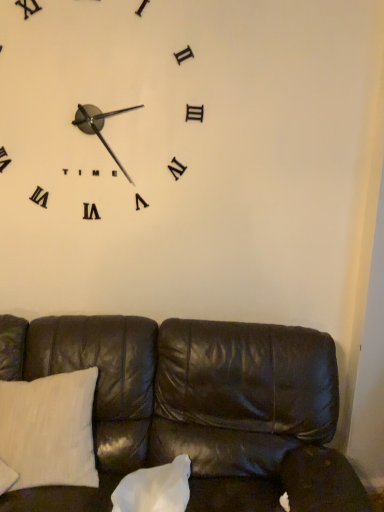
I want to click on white cotton pillow at lower left, marked as the 1th pillow in a left-to-right arrangement, so click(49, 429).

Locate an element on the screen. The height and width of the screenshot is (512, 384). white cotton pillow at lower left, the 2th pillow in the right-to-left sequence is located at coordinates (49, 429).

From the image's perspective, who appears lower, white cotton pillow at lower left, marked as the 1th pillow in a left-to-right arrangement, or white matte clock at upper left?

white cotton pillow at lower left, marked as the 1th pillow in a left-to-right arrangement, from the image's perspective.

Looking at their sizes, would you say white cotton pillow at lower left, marked as the 1th pillow in a left-to-right arrangement, is wider or thinner than white matte clock at upper left?

white cotton pillow at lower left, marked as the 1th pillow in a left-to-right arrangement, is wider than white matte clock at upper left.

From a real-world perspective, which is physically below, white cotton pillow at lower left, the 2th pillow in the right-to-left sequence, or white matte clock at upper left?

white cotton pillow at lower left, the 2th pillow in the right-to-left sequence, from a real-world perspective.

Considering the positions of point (74, 423) and point (106, 93), is point (74, 423) closer or farther from the camera than point (106, 93)?

Point (74, 423) is closer to the camera than point (106, 93).

In the scene shown: Does white matte pillow at center, which is the 1th pillow in right-to-left order, have a greater width compared to white cotton pillow at lower left, the 2th pillow in the right-to-left sequence?

Indeed, white matte pillow at center, which is the 1th pillow in right-to-left order, has a greater width compared to white cotton pillow at lower left, the 2th pillow in the right-to-left sequence.

Identify the location of pillow above the white matte pillow at center, which is the 1th pillow in right-to-left order (from a real-world perspective). (49, 429).

What's the angular difference between white matte pillow at center, which is the 1th pillow in right-to-left order, and white cotton pillow at lower left, marked as the 1th pillow in a left-to-right arrangement,'s facing directions?

white matte pillow at center, which is the 1th pillow in right-to-left order, and white cotton pillow at lower left, marked as the 1th pillow in a left-to-right arrangement, are facing 0.451 degrees away from each other.

Which point is more forward, (178, 457) or (86, 377)?

The point (178, 457) is more forward.

Is white matte clock at upper left to the left of leather couch at lower center from the viewer's perspective?

Correct, you'll find white matte clock at upper left to the left of leather couch at lower center.

Is point (28, 49) positioned after point (137, 317)?

No, it is in front of (137, 317).

Would you consider white matte clock at upper left to be distant from leather couch at lower center?

That's not correct — white matte clock at upper left is a little close to leather couch at lower center.

Considering the sizes of objects white matte clock at upper left and leather couch at lower center in the image provided, who is wider, white matte clock at upper left or leather couch at lower center?

Wider between the two is leather couch at lower center.

Considering the relative sizes of leather couch at lower center and white matte pillow at center, the second pillow positioned from the left, in the image provided, is leather couch at lower center bigger than white matte pillow at center, the second pillow positioned from the left,?

Yes, leather couch at lower center is bigger than white matte pillow at center, the second pillow positioned from the left.

From a real-world perspective, between leather couch at lower center and white matte pillow at center, which is the 1th pillow in right-to-left order, who is vertically higher?

leather couch at lower center is physically above.

Which of these two, leather couch at lower center or white matte pillow at center, which is the 1th pillow in right-to-left order, stands shorter?

white matte pillow at center, which is the 1th pillow in right-to-left order, is shorter.

Does leather couch at lower center appear on the right side of white matte pillow at center, the second pillow positioned from the left?

No, leather couch at lower center is not to the right of white matte pillow at center, the second pillow positioned from the left.

Is white matte clock at upper left completely or partially outside of white cotton pillow at lower left, marked as the 1th pillow in a left-to-right arrangement?

Indeed, white matte clock at upper left is completely outside white cotton pillow at lower left, marked as the 1th pillow in a left-to-right arrangement.

Locate an element on the screen. wall clock above the white cotton pillow at lower left, the 2th pillow in the right-to-left sequence (from a real-world perspective) is located at coordinates (106, 111).

Based on their positions, is white matte clock at upper left located to the left or right of white cotton pillow at lower left, the 2th pillow in the right-to-left sequence?

white matte clock at upper left is positioned on white cotton pillow at lower left, the 2th pillow in the right-to-left sequence,'s right side.

Who is shorter, white matte clock at upper left or white cotton pillow at lower left, the 2th pillow in the right-to-left sequence?

With less height is white cotton pillow at lower left, the 2th pillow in the right-to-left sequence.

Can you confirm if white cotton pillow at lower left, the 2th pillow in the right-to-left sequence, is thinner than white matte pillow at center, which is the 1th pillow in right-to-left order?

Indeed, white cotton pillow at lower left, the 2th pillow in the right-to-left sequence, has a lesser width compared to white matte pillow at center, which is the 1th pillow in right-to-left order.

From a real-world perspective, which is physically above, white cotton pillow at lower left, the 2th pillow in the right-to-left sequence, or white matte pillow at center, the second pillow positioned from the left?

From a 3D spatial view, white cotton pillow at lower left, the 2th pillow in the right-to-left sequence, is above.

Is white cotton pillow at lower left, marked as the 1th pillow in a left-to-right arrangement, at the right side of white matte pillow at center, the second pillow positioned from the left?

No.

How many degrees apart are the facing directions of leather couch at lower center and white cotton pillow at lower left, the 2th pillow in the right-to-left sequence?

The angular difference between leather couch at lower center and white cotton pillow at lower left, the 2th pillow in the right-to-left sequence, is 5.86 degrees.

Find the location of a particular element. The image size is (384, 512). pillow located above the leather couch at lower center (from the image's perspective) is located at coordinates (49, 429).

Could you measure the distance between leather couch at lower center and white cotton pillow at lower left, marked as the 1th pillow in a left-to-right arrangement?

The distance of leather couch at lower center from white cotton pillow at lower left, marked as the 1th pillow in a left-to-right arrangement, is 10.85 inches.

Considering the positions of objects leather couch at lower center and white cotton pillow at lower left, marked as the 1th pillow in a left-to-right arrangement, in the image provided, who is behind, leather couch at lower center or white cotton pillow at lower left, marked as the 1th pillow in a left-to-right arrangement,?

Positioned behind is white cotton pillow at lower left, marked as the 1th pillow in a left-to-right arrangement.

Find the location of a particular element. This screenshot has width=384, height=512. the 1st pillow in front of the white matte clock at upper left, starting your count from the anchor is located at coordinates (49, 429).

The width and height of the screenshot is (384, 512). In order to click on pillow on the right of the white cotton pillow at lower left, marked as the 1th pillow in a left-to-right arrangement in this screenshot , I will do `click(155, 488)`.

Looking at the image, which one is located closer to leather couch at lower center, white cotton pillow at lower left, marked as the 1th pillow in a left-to-right arrangement, or white matte clock at upper left?

white cotton pillow at lower left, marked as the 1th pillow in a left-to-right arrangement, is closer to leather couch at lower center.

Looking at the image, which one is located further to white matte clock at upper left, leather couch at lower center or white matte pillow at center, which is the 1th pillow in right-to-left order?

white matte pillow at center, which is the 1th pillow in right-to-left order, is further to white matte clock at upper left.

Which object lies further to the anchor point white matte clock at upper left, white cotton pillow at lower left, marked as the 1th pillow in a left-to-right arrangement, or white matte pillow at center, the second pillow positioned from the left?

white matte pillow at center, the second pillow positioned from the left, lies further to white matte clock at upper left than the other object.

Looking at this image, based on their spatial positions, is white matte clock at upper left or leather couch at lower center further from white matte pillow at center, which is the 1th pillow in right-to-left order?

Based on the image, white matte clock at upper left appears to be further to white matte pillow at center, which is the 1th pillow in right-to-left order.

When comparing their distances from leather couch at lower center, does white matte clock at upper left or white matte pillow at center, the second pillow positioned from the left, seem closer?

Answer: Based on the image, white matte pillow at center, the second pillow positioned from the left, appears to be nearer to leather couch at lower center.

Looking at the image, which one is located further to white matte clock at upper left, white matte pillow at center, the second pillow positioned from the left, or leather couch at lower center?

Based on the image, white matte pillow at center, the second pillow positioned from the left, appears to be further to white matte clock at upper left.

Which object lies nearer to the anchor point white matte clock at upper left, white matte pillow at center, the second pillow positioned from the left, or white cotton pillow at lower left, the 2th pillow in the right-to-left sequence?

white cotton pillow at lower left, the 2th pillow in the right-to-left sequence.

Based on their spatial positions, is leather couch at lower center or white cotton pillow at lower left, the 2th pillow in the right-to-left sequence, closer to white matte pillow at center, the second pillow positioned from the left?

Based on the image, leather couch at lower center appears to be nearer to white matte pillow at center, the second pillow positioned from the left.

Where is `pillow that lies between white matte clock at upper left and white matte pillow at center, which is the 1th pillow in right-to-left order, from top to bottom`? The height and width of the screenshot is (512, 384). pillow that lies between white matte clock at upper left and white matte pillow at center, which is the 1th pillow in right-to-left order, from top to bottom is located at coordinates (49, 429).

What are the coordinates of `studio couch located between white cotton pillow at lower left, marked as the 1th pillow in a left-to-right arrangement, and white matte pillow at center, the second pillow positioned from the left, in the left-right direction` in the screenshot? It's located at (x=196, y=409).

The image size is (384, 512). I want to click on pillow between white matte clock at upper left and leather couch at lower center vertically, so click(x=49, y=429).

Find the location of a particular element. studio couch between white matte clock at upper left and white matte pillow at center, the second pillow positioned from the left, vertically is located at coordinates pos(196,409).